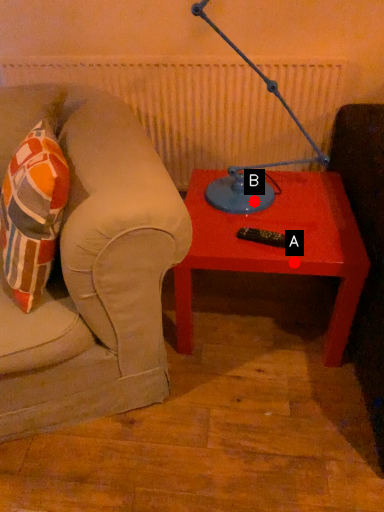
Question: Two points are circled on the image, labeled by A and B beside each circle. Which point is further to the camera?

Choices:
 (A) A is further
 (B) B is further

Answer: (B)